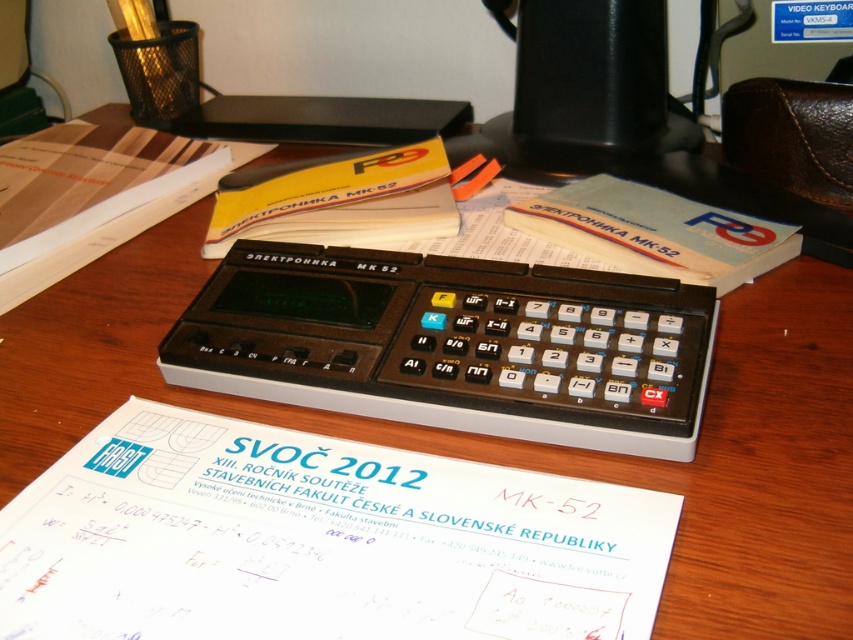
You are organizing a desk and need to place the white paper at center and the black plastic calculator at center. The desk has a 4.5 inch wide space between them. Can you fit both items in the space without overlapping?

The white paper at center is 3.60 inches from the black plastic calculator at center. Since the available space is 4.5 inches, which is wider than the distance between them, both items can fit in the space without overlapping.

You are organizing the desk and need to move the white paper at center and the black plastic calculator at center. If you want to place them in the order they appear from your perspective, which item should you move first?

The white paper at center is in front of the black plastic calculator at center, so you should move the white paper at center first to access the calculator underneath.

You are standing in front of the vintage calculator on the wooden desk. There are two points marked on the desk surface. Which of the two points, point (x=492, y=556) or point (x=424, y=356), is closer to you?

Point (x=492, y=556) is closer to the viewer than point (x=424, y=356).